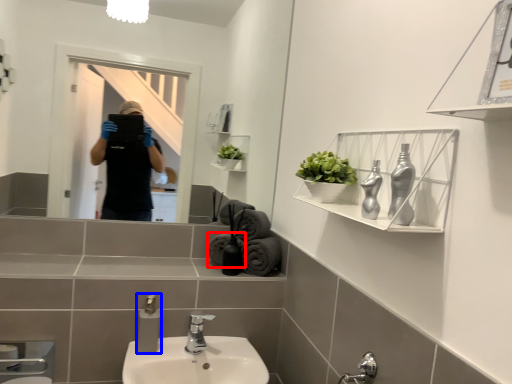
Question: Among these objects, which one is nearest to the camera, bath towel (highlighted by a red box) or soap dispenser (highlighted by a blue box)?

Choices:
 (A) bath towel
 (B) soap dispenser

Answer: (B)